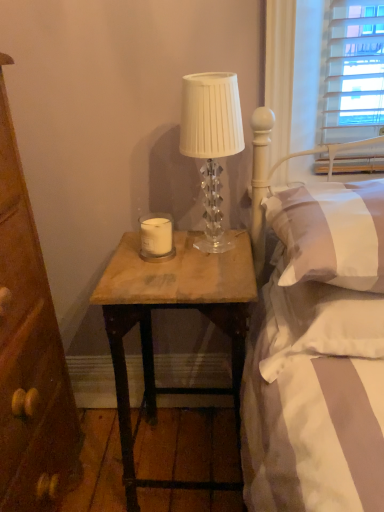
At what (x,y) coordinates should I click in order to perform the action: click on vacant space in front of clear crystal lamp at upper center. Please return your answer as a coordinate pair (x, y). The height and width of the screenshot is (512, 384). Looking at the image, I should click on (207, 274).